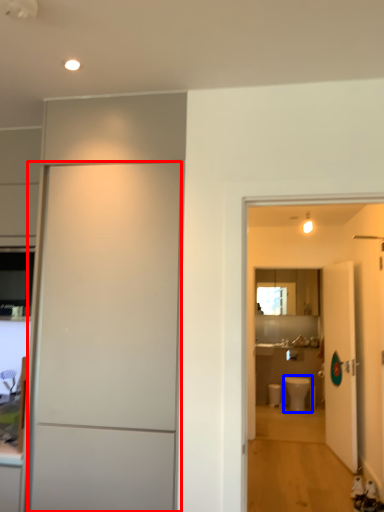
Question: Which object is further to the camera taking this photo, door (highlighted by a red box) or toilet (highlighted by a blue box)?

Choices:
 (A) door
 (B) toilet

Answer: (B)